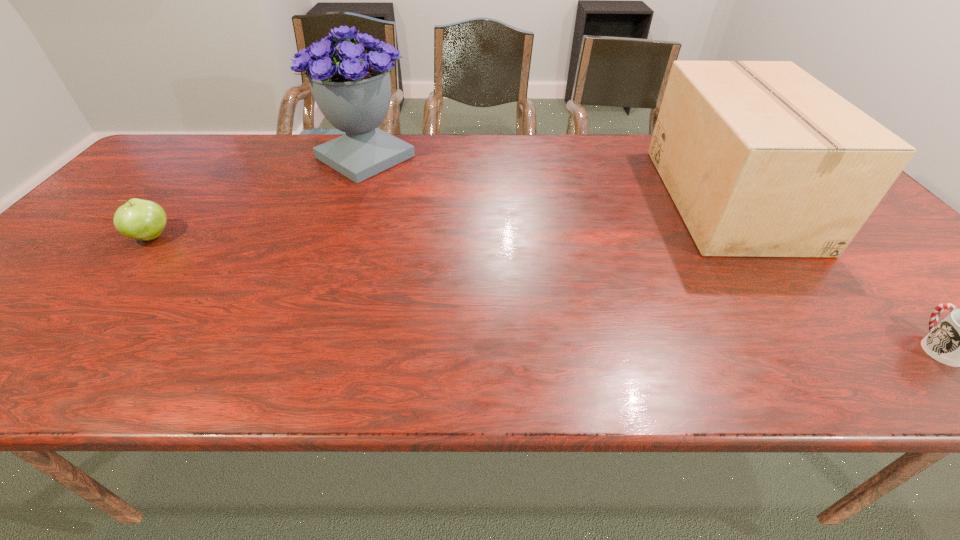
The height and width of the screenshot is (540, 960). In order to click on vacant space in between the box and the bouquet in this screenshot , I will do `click(547, 178)`.

The height and width of the screenshot is (540, 960). I want to click on vacant space that's between the box and the bouquet, so click(547, 178).

Locate an element on the screen. The height and width of the screenshot is (540, 960). free space between the apple and the third shortest object is located at coordinates (441, 218).

Locate an element on the screen. This screenshot has height=540, width=960. free space that is in between the third tallest object and the tallest object is located at coordinates (258, 197).

Locate an element on the screen. object identified as the closest to the box is located at coordinates (959, 340).

Identify which object is the third closest to the second tallest object. Please provide its 2D coordinates. Your answer should be formatted as a tuple, i.e. [(x, y)], where the tuple contains the x and y coordinates of a point satisfying the conditions above.

[(138, 219)]

Identify the location of vacant space that satisfies the following two spatial constraints: 1. on the back side of the third shortest object; 2. on the right side of the leftmost object. The image size is (960, 540). (184, 198).

Identify the location of vacant space that satisfies the following two spatial constraints: 1. on the front side of the third object from right to left; 2. on the right side of the second tallest object. (350, 198).